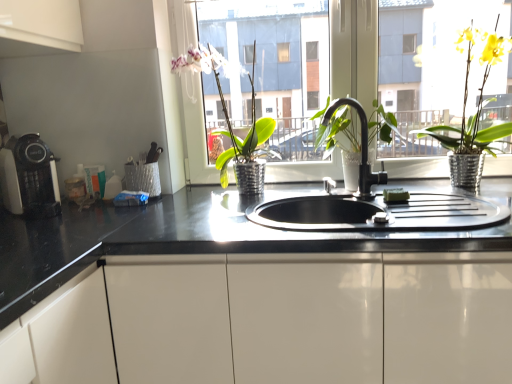
Question: Is the depth of black matte faucet at center less than that of matte black coffee machine at left?

Choices:
 (A) no
 (B) yes

Answer: (B)

Question: From a real-world perspective, is black matte faucet at center on top of matte black coffee machine at left?

Choices:
 (A) no
 (B) yes

Answer: (B)

Question: Is black matte faucet at center looking in the opposite direction of matte black coffee machine at left?

Choices:
 (A) no
 (B) yes

Answer: (A)

Question: From the image's perspective, does black matte faucet at center appear lower than matte black coffee machine at left?

Choices:
 (A) yes
 (B) no

Answer: (B)

Question: Is black matte faucet at center directly adjacent to matte black coffee machine at left?

Choices:
 (A) yes
 (B) no

Answer: (B)

Question: Is green metallic pot at center, which is counted as the second houseplant, starting from the right, spatially inside yellow metallic pot at upper right, placed as the first houseplant when sorted from right to left, or outside of it?

Choices:
 (A) inside
 (B) outside

Answer: (B)

Question: Looking at their shapes, would you say green metallic pot at center, which is counted as the second houseplant, starting from the right, is wider or thinner than yellow metallic pot at upper right, which is the 2th houseplant from left to right?

Choices:
 (A) wide
 (B) thin

Answer: (A)

Question: From their relative heights in the image, would you say green metallic pot at center, the 1th houseplant from the left, is taller or shorter than yellow metallic pot at upper right, placed as the first houseplant when sorted from right to left?

Choices:
 (A) tall
 (B) short

Answer: (B)

Question: From the image's perspective, is green metallic pot at center, which is counted as the second houseplant, starting from the right, positioned above or below yellow metallic pot at upper right, placed as the first houseplant when sorted from right to left?

Choices:
 (A) below
 (B) above

Answer: (A)

Question: Considering the positions of transparent glass window at center and green metallic pot at center, which is counted as the second houseplant, starting from the right, in the image, is transparent glass window at center wider or thinner than green metallic pot at center, which is counted as the second houseplant, starting from the right,?

Choices:
 (A) thin
 (B) wide

Answer: (A)

Question: Considering the relative positions of transparent glass window at center and green metallic pot at center, which is counted as the second houseplant, starting from the right, in the image provided, is transparent glass window at center to the left or to the right of green metallic pot at center, which is counted as the second houseplant, starting from the right,?

Choices:
 (A) left
 (B) right

Answer: (B)

Question: Is point (456, 77) closer or farther from the camera than point (217, 59)?

Choices:
 (A) closer
 (B) farther

Answer: (A)

Question: From the image's perspective, is transparent glass window at center located above or below green metallic pot at center, which is counted as the second houseplant, starting from the right?

Choices:
 (A) below
 (B) above

Answer: (B)

Question: Is point (474, 244) closer or farther from the camera than point (39, 144)?

Choices:
 (A) farther
 (B) closer

Answer: (B)

Question: From their relative heights in the image, would you say black glossy countertop at center is taller or shorter than matte black coffee machine at left?

Choices:
 (A) short
 (B) tall

Answer: (B)